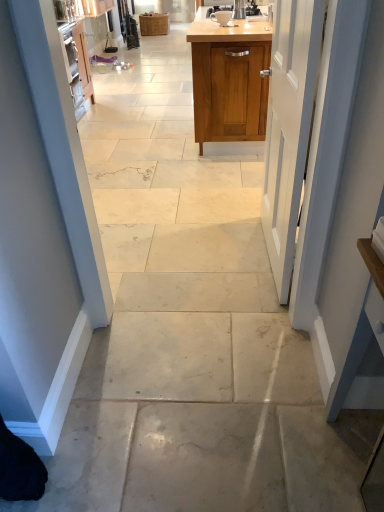
In order to click on vacant space behind white painted wood door at center in this screenshot , I will do `click(225, 212)`.